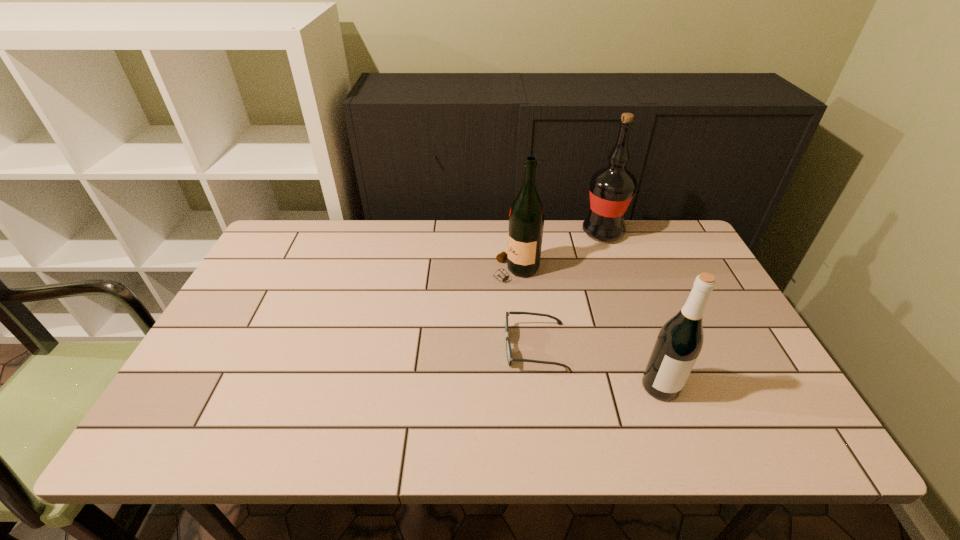
Find the location of a particular element. Image resolution: width=960 pixels, height=540 pixels. the second closest wine bottle to the farthest object is located at coordinates (679, 343).

Locate which wine bottle ranks in proximity to the nearest wine bottle. Please provide its 2D coordinates. Your answer should be formatted as a tuple, i.e. [(x, y)], where the tuple contains the x and y coordinates of a point satisfying the conditions above.

[(526, 218)]

The image size is (960, 540). I want to click on vacant area in the image that satisfies the following two spatial constraints: 1. on the front side of the farthest wine bottle; 2. on the face of the spectacles, so tap(644, 347).

This screenshot has height=540, width=960. I want to click on free location that satisfies the following two spatial constraints: 1. on the front side of the farthest object; 2. on the surface of the second farthest object, so click(616, 270).

Locate an element on the screen. This screenshot has height=540, width=960. free location that satisfies the following two spatial constraints: 1. on the front side of the farthest object; 2. on the surface of the third nearest object is located at coordinates (616, 270).